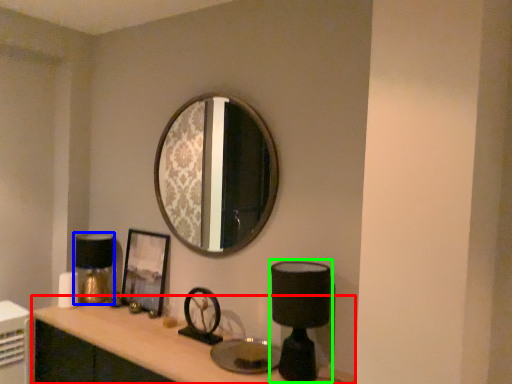
Question: Based on their relative distances, which object is farther from computer desk (highlighted by a red box)? Choose from table lamp (highlighted by a blue box) and table lamp (highlighted by a green box).

Choices:
 (A) table lamp
 (B) table lamp

Answer: (B)